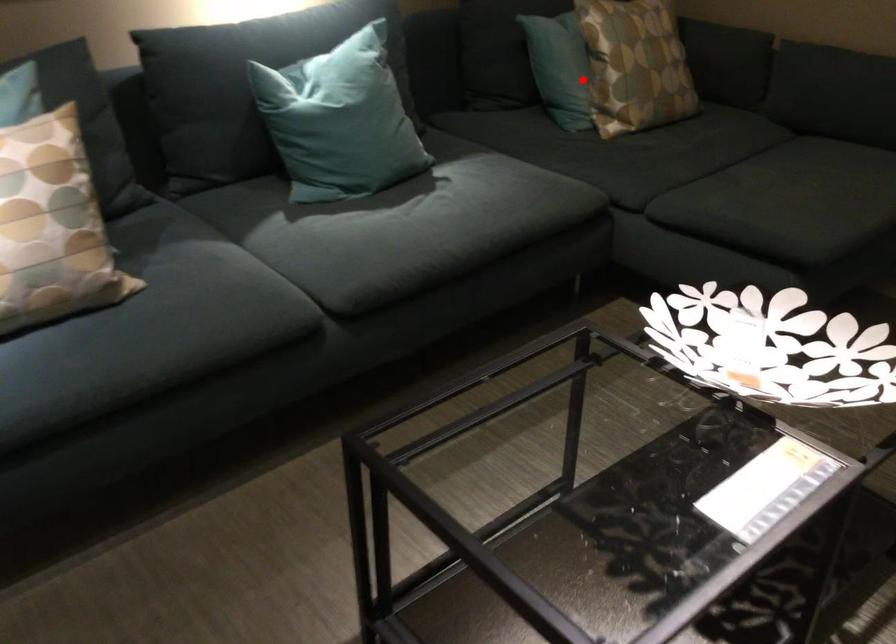
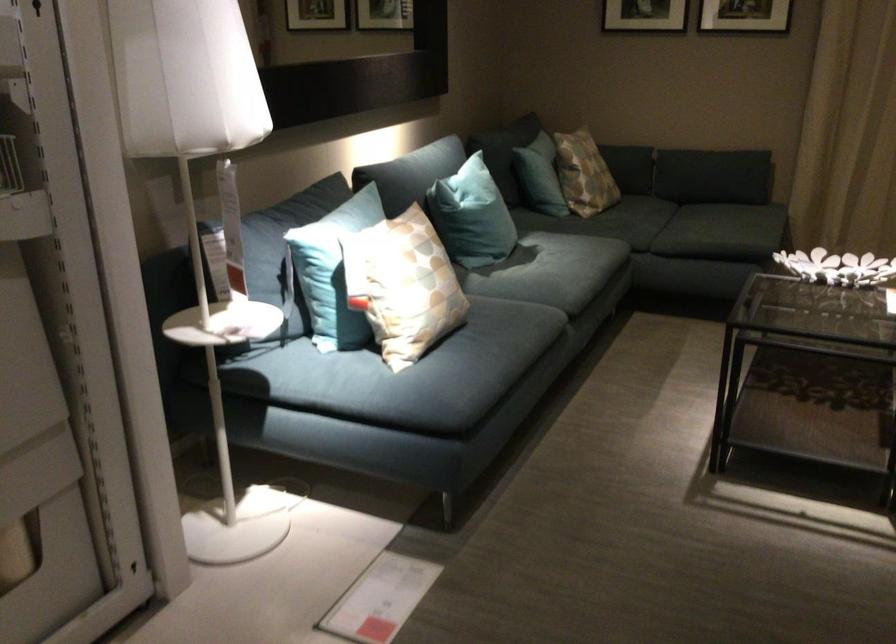
Question: I am providing you with two images of the same scene from different viewpoints. A red point is shown in image1. For the corresponding object point in image2, is it positioned nearer or farther from the camera?

Choices:
 (A) Nearer
 (B) Farther

Answer: (B)